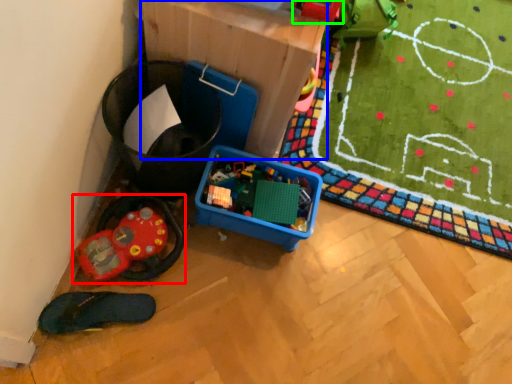
Question: Considering the real-world distances, which object is closest to toy (highlighted by a red box)? cardboard box (highlighted by a blue box) or toy (highlighted by a green box).

Choices:
 (A) cardboard box
 (B) toy

Answer: (A)